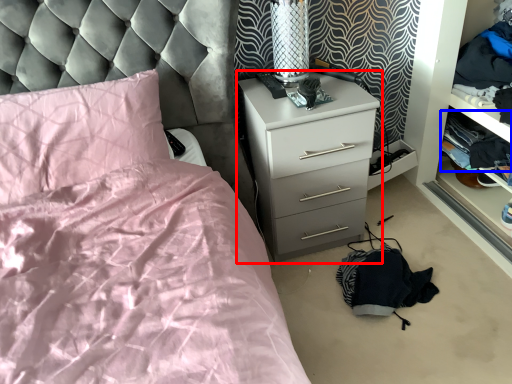
Question: Which object is closer to the camera taking this photo, chest of drawers (highlighted by a red box) or clothing (highlighted by a blue box)?

Choices:
 (A) chest of drawers
 (B) clothing

Answer: (A)